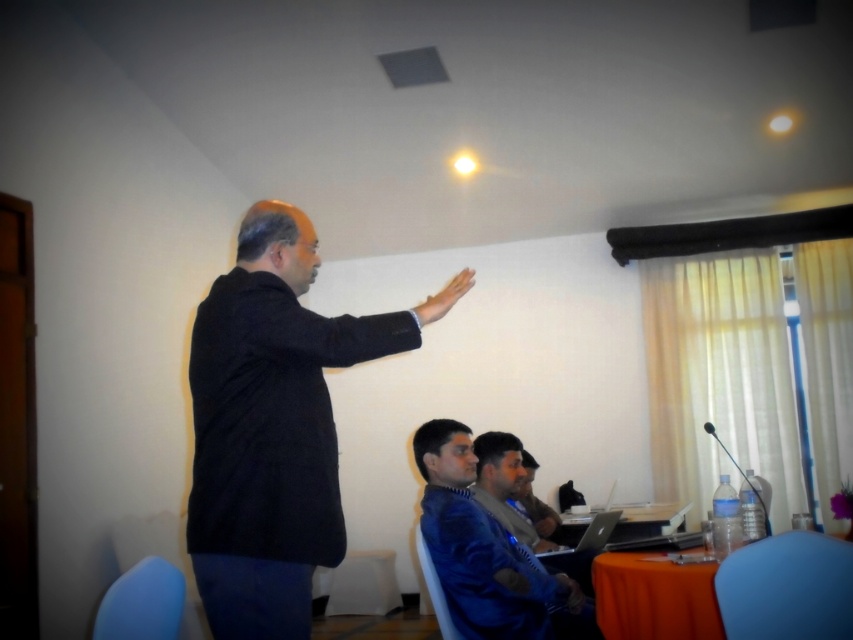
Can you confirm if orange fabric table at lower right is wider than blue velvet jacket at lower center?

Incorrect, orange fabric table at lower right's width does not surpass blue velvet jacket at lower center's.

Can you confirm if orange fabric table at lower right is bigger than blue velvet jacket at lower center?

No.

In order to click on orange fabric table at lower right in this screenshot , I will do `click(730, 593)`.

Is black matte suit at upper left below blue velvet jacket at lower center?

Incorrect, black matte suit at upper left is not positioned below blue velvet jacket at lower center.

Which of these two, black matte suit at upper left or blue velvet jacket at lower center, stands shorter?

blue velvet jacket at lower center

Is point (293, 483) more distant than point (578, 620)?

That is False.

In order to click on black matte suit at upper left in this screenshot , I will do [x=274, y=426].

Between black matte suit at upper left and orange fabric table at lower right, which one has less height?

orange fabric table at lower right

Is black matte suit at upper left in front of orange fabric table at lower right?

Yes, it is.

Does point (276, 348) come in front of point (770, 627)?

Yes, it is in front of point (770, 627).

The height and width of the screenshot is (640, 853). In order to click on black matte suit at upper left in this screenshot , I will do `click(274, 426)`.